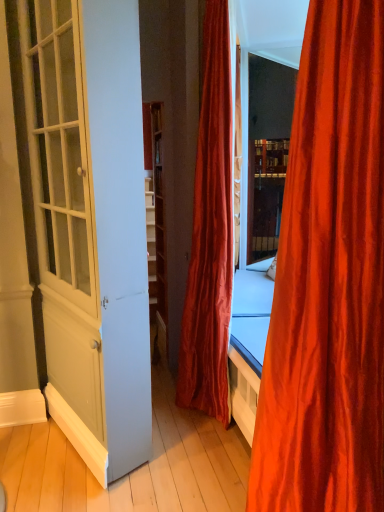
In order to click on white glossy door at left in this screenshot , I will do `click(90, 219)`.

What is the approximate width of velvet red curtain at center, which is the 1th curtain from back to front?

velvet red curtain at center, which is the 1th curtain from back to front, is 38.95 centimeters in width.

Identify the location of silky orange curtain at right, the first curtain in the front-to-back sequence. This screenshot has height=512, width=384. (328, 280).

Is velvet red curtain at center, which appears as the second curtain when viewed from the front, not near silky orange curtain at right, the first curtain in the front-to-back sequence?

velvet red curtain at center, which appears as the second curtain when viewed from the front, is far away from silky orange curtain at right, the first curtain in the front-to-back sequence.

Does point (228, 423) lie behind point (272, 420)?

Yes.

From a real-world perspective, who is located lower, velvet red curtain at center, which is the 1th curtain from back to front, or silky orange curtain at right, the first curtain in the front-to-back sequence?

In real-world perspective, silky orange curtain at right, the first curtain in the front-to-back sequence, is lower.

Does velvet red curtain at center, which is the 1th curtain from back to front, come behind silky orange curtain at right, the first curtain in the front-to-back sequence?

Yes, velvet red curtain at center, which is the 1th curtain from back to front, is behind silky orange curtain at right, the first curtain in the front-to-back sequence.

From the picture: From a real-world perspective, does silky orange curtain at right, the first curtain in the front-to-back sequence, sit lower than velvet red curtain at center, which appears as the second curtain when viewed from the front?

Yes, from a real-world perspective, silky orange curtain at right, the first curtain in the front-to-back sequence, is below velvet red curtain at center, which appears as the second curtain when viewed from the front.

Between silky orange curtain at right, the first curtain in the front-to-back sequence, and velvet red curtain at center, which appears as the second curtain when viewed from the front, which one has larger width?

Wider between the two is silky orange curtain at right, the first curtain in the front-to-back sequence.

Between point (324, 175) and point (217, 12), which one is positioned behind?

The point (217, 12) is farther.

In the scene shown: Is silky orange curtain at right, the first curtain in the front-to-back sequence, next to velvet red curtain at center, which is the 1th curtain from back to front?

No, silky orange curtain at right, the first curtain in the front-to-back sequence, is not beside velvet red curtain at center, which is the 1th curtain from back to front.

In the scene shown: Can you confirm if white glossy door at left is wider than silky orange curtain at right, the first curtain in the front-to-back sequence?

Incorrect, the width of white glossy door at left does not surpass that of silky orange curtain at right, the first curtain in the front-to-back sequence.

Is silky orange curtain at right, arranged as the second curtain when viewed from the back, a part of white glossy door at left?

Definitely not — silky orange curtain at right, arranged as the second curtain when viewed from the back, is not inside white glossy door at left.

Which point is more distant from viewer, (42, 90) or (318, 225)?

Point (42, 90)

How different are the orientations of velvet red curtain at center, which appears as the second curtain when viewed from the front, and white glossy door at left in degrees?

23.8 degrees separate the facing orientations of velvet red curtain at center, which appears as the second curtain when viewed from the front, and white glossy door at left.

Consider the image. Between velvet red curtain at center, which is the 1th curtain from back to front, and white glossy door at left, which one is positioned in front?

Positioned in front is white glossy door at left.

Between velvet red curtain at center, which is the 1th curtain from back to front, and white glossy door at left, which one has smaller size?

velvet red curtain at center, which is the 1th curtain from back to front, is smaller.

Considering the sizes of velvet red curtain at center, which appears as the second curtain when viewed from the front, and white glossy door at left in the image, is velvet red curtain at center, which appears as the second curtain when viewed from the front, wider or thinner than white glossy door at left?

In the image, velvet red curtain at center, which appears as the second curtain when viewed from the front, appears to be wider than white glossy door at left.

Is white glossy door at left turned away from velvet red curtain at center, which is the 1th curtain from back to front?

Yes, white glossy door at left is facing away from velvet red curtain at center, which is the 1th curtain from back to front.

From a real-world perspective, between white glossy door at left and velvet red curtain at center, which is the 1th curtain from back to front, who is vertically higher?

velvet red curtain at center, which is the 1th curtain from back to front, from a real-world perspective.

From the image's perspective, between white glossy door at left and velvet red curtain at center, which appears as the second curtain when viewed from the front, who is located below?

white glossy door at left appears lower in the image.

Consider the image. Based on their sizes in the image, would you say white glossy door at left is bigger or smaller than velvet red curtain at center, which is the 1th curtain from back to front?

In the image, white glossy door at left appears to be larger than velvet red curtain at center, which is the 1th curtain from back to front.

Which of these two, silky orange curtain at right, arranged as the second curtain when viewed from the back, or white glossy door at left, is bigger?

white glossy door at left is bigger.

Is silky orange curtain at right, arranged as the second curtain when viewed from the back, positioned with its back to white glossy door at left?

No, silky orange curtain at right, arranged as the second curtain when viewed from the back, is not facing away from white glossy door at left.

From the image's perspective, relative to white glossy door at left, is silky orange curtain at right, the first curtain in the front-to-back sequence, above or below?

silky orange curtain at right, the first curtain in the front-to-back sequence, is below white glossy door at left.

How many degrees apart are the facing directions of silky orange curtain at right, arranged as the second curtain when viewed from the back, and white glossy door at left?

The angular difference between silky orange curtain at right, arranged as the second curtain when viewed from the back, and white glossy door at left is 23.8 degrees.

Where is `curtain on the left of silky orange curtain at right, the first curtain in the front-to-back sequence`? This screenshot has width=384, height=512. curtain on the left of silky orange curtain at right, the first curtain in the front-to-back sequence is located at coordinates (210, 234).

Locate an element on the screen. The height and width of the screenshot is (512, 384). curtain directly beneath the velvet red curtain at center, which is the 1th curtain from back to front (from a real-world perspective) is located at coordinates [328, 280].

When comparing their distances from velvet red curtain at center, which is the 1th curtain from back to front, does silky orange curtain at right, arranged as the second curtain when viewed from the back, or white glossy door at left seem further?

silky orange curtain at right, arranged as the second curtain when viewed from the back.

From the image, which object appears to be nearer to velvet red curtain at center, which appears as the second curtain when viewed from the front, white glossy door at left or silky orange curtain at right, arranged as the second curtain when viewed from the back?

white glossy door at left lies closer to velvet red curtain at center, which appears as the second curtain when viewed from the front, than the other object.

Consider the image. Which object lies further to the anchor point white glossy door at left, silky orange curtain at right, the first curtain in the front-to-back sequence, or velvet red curtain at center, which appears as the second curtain when viewed from the front?

silky orange curtain at right, the first curtain in the front-to-back sequence, lies further to white glossy door at left than the other object.

From the image, which object appears to be nearer to silky orange curtain at right, arranged as the second curtain when viewed from the back, velvet red curtain at center, which is the 1th curtain from back to front, or white glossy door at left?

Based on the image, white glossy door at left appears to be nearer to silky orange curtain at right, arranged as the second curtain when viewed from the back.

Which object lies nearer to the anchor point white glossy door at left, velvet red curtain at center, which is the 1th curtain from back to front, or silky orange curtain at right, arranged as the second curtain when viewed from the back?

Based on the image, velvet red curtain at center, which is the 1th curtain from back to front, appears to be nearer to white glossy door at left.

Considering their positions, is white glossy door at left positioned closer to silky orange curtain at right, arranged as the second curtain when viewed from the back, than velvet red curtain at center, which appears as the second curtain when viewed from the front?

The object closer to silky orange curtain at right, arranged as the second curtain when viewed from the back, is white glossy door at left.

Where is `screen door between silky orange curtain at right, arranged as the second curtain when viewed from the back, and velvet red curtain at center, which is the 1th curtain from back to front, in the front-back direction`? screen door between silky orange curtain at right, arranged as the second curtain when viewed from the back, and velvet red curtain at center, which is the 1th curtain from back to front, in the front-back direction is located at coordinates (90, 219).